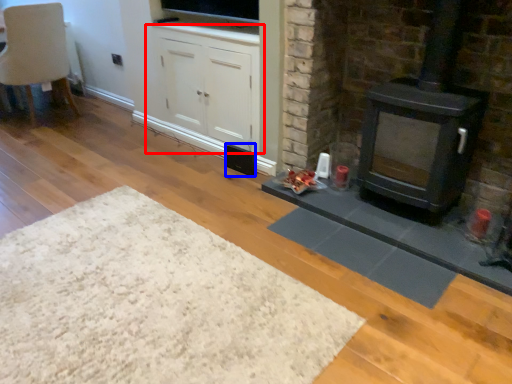
Question: Among these objects, which one is farthest to the camera, cabinetry (highlighted by a red box) or speaker (highlighted by a blue box)?

Choices:
 (A) cabinetry
 (B) speaker

Answer: (B)